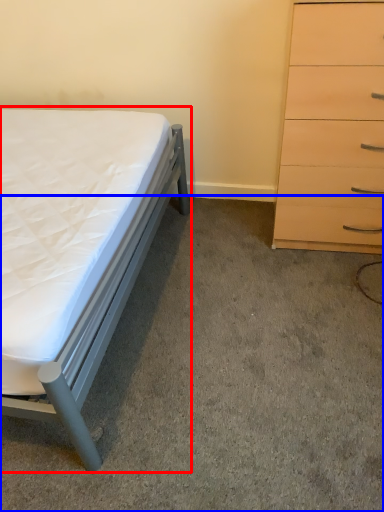
Question: Which object appears closest to the camera in this image, bed (highlighted by a red box) or concrete (highlighted by a blue box)?

Choices:
 (A) bed
 (B) concrete

Answer: (A)